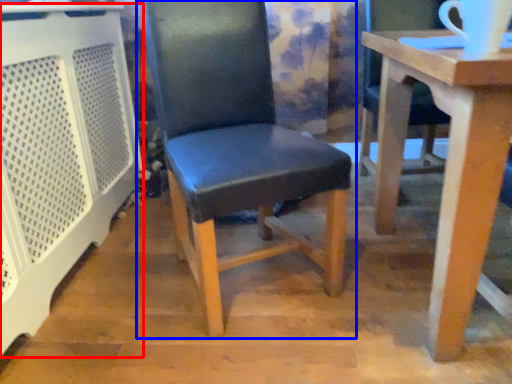
Question: Which of the following is the closest to the observer, cage (highlighted by a red box) or chair (highlighted by a blue box)?

Choices:
 (A) cage
 (B) chair

Answer: (A)